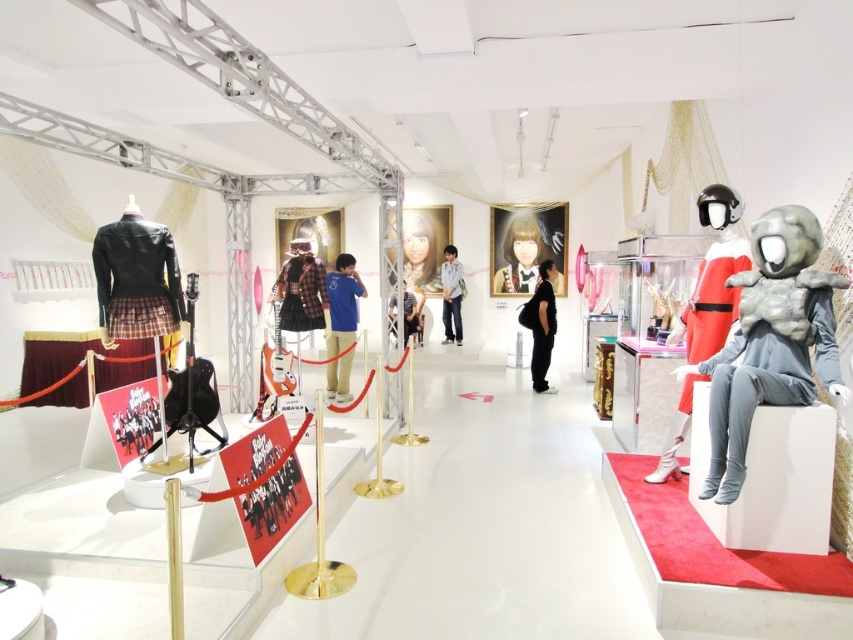
Is smooth glossy portrait at center positioned in front of matte black jacket at center?

No, smooth glossy portrait at center is behind matte black jacket at center.

Locate an element on the screen. The height and width of the screenshot is (640, 853). smooth glossy portrait at center is located at coordinates (520, 257).

Who is more forward, (515, 260) or (392, 298)?

Positioned in front is point (392, 298).

The height and width of the screenshot is (640, 853). Identify the location of smooth glossy portrait at center. (520, 257).

Can you confirm if leather jacket at left is thinner than matte black jacket at center?

No.

Who is lower down, leather jacket at left or matte black jacket at center?

matte black jacket at center is lower down.

Which is in front, point (123, 298) or point (410, 292)?

Positioned in front is point (123, 298).

You are a GUI agent. You are given a task and a screenshot of the screen. Output one action in this format:
    pyautogui.click(x=<x>, y=<y>)
    Task: Click on the leather jacket at left
    Image resolution: width=853 pixels, height=640 pixels.
    Given the screenshot: What is the action you would take?
    pyautogui.click(x=136, y=276)

Can you confirm if leather jacket at left is taller than smooth glossy portrait at center?

No.

Which is in front, point (102, 264) or point (540, 244)?

Point (102, 264)

This screenshot has height=640, width=853. Identify the location of leather jacket at left. (136, 276).